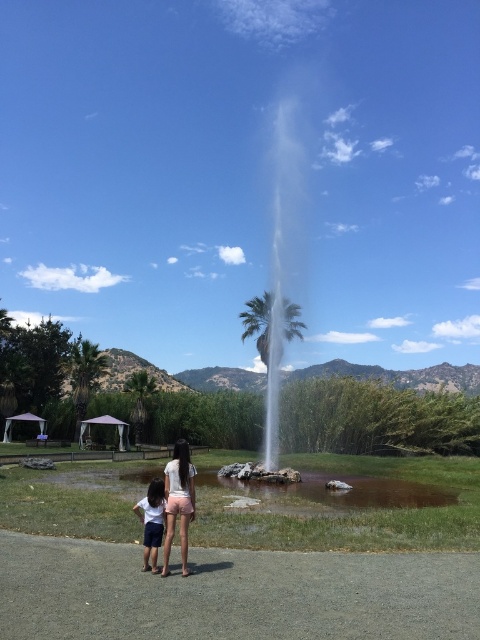
You are standing on the paved area and want to take a photo of the white frothy water at center. Which direction should you face to ensure the fountain is in the center of your photo?

You should face towards the white frothy water at center, which is located at the center of the image according to its coordinates, so pointing your camera directly at it will center the fountain in your photo.